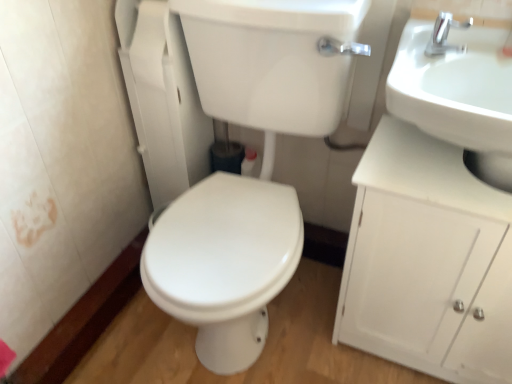
Question: Does white glossy sink at upper right have a larger size compared to silver metallic faucet at upper right?

Choices:
 (A) yes
 (B) no

Answer: (A)

Question: Can you confirm if white glossy sink at upper right is smaller than silver metallic faucet at upper right?

Choices:
 (A) yes
 (B) no

Answer: (B)

Question: Does white glossy sink at upper right touch silver metallic faucet at upper right?

Choices:
 (A) no
 (B) yes

Answer: (A)

Question: From the image's perspective, is white glossy sink at upper right on silver metallic faucet at upper right?

Choices:
 (A) yes
 (B) no

Answer: (B)

Question: Does white glossy sink at upper right have a greater height compared to silver metallic faucet at upper right?

Choices:
 (A) yes
 (B) no

Answer: (A)

Question: Is white glossy sink at upper right further to camera compared to silver metallic faucet at upper right?

Choices:
 (A) yes
 (B) no

Answer: (B)

Question: Is silver metallic faucet at upper right not within white matte cabinet at right?

Choices:
 (A) yes
 (B) no

Answer: (A)

Question: Considering the relative positions of silver metallic faucet at upper right and white matte cabinet at right in the image provided, is silver metallic faucet at upper right to the left of white matte cabinet at right from the viewer's perspective?

Choices:
 (A) yes
 (B) no

Answer: (A)

Question: Does silver metallic faucet at upper right come in front of white matte cabinet at right?

Choices:
 (A) yes
 (B) no

Answer: (B)

Question: From the image's perspective, is silver metallic faucet at upper right on white matte cabinet at right?

Choices:
 (A) yes
 (B) no

Answer: (A)

Question: Considering the relative positions of silver metallic faucet at upper right and white matte cabinet at right in the image provided, is silver metallic faucet at upper right behind white matte cabinet at right?

Choices:
 (A) yes
 (B) no

Answer: (A)

Question: From a real-world perspective, is silver metallic faucet at upper right below white matte cabinet at right?

Choices:
 (A) no
 (B) yes

Answer: (A)

Question: Is white glossy sink at upper right inside silver metallic faucet at upper right?

Choices:
 (A) yes
 (B) no

Answer: (B)